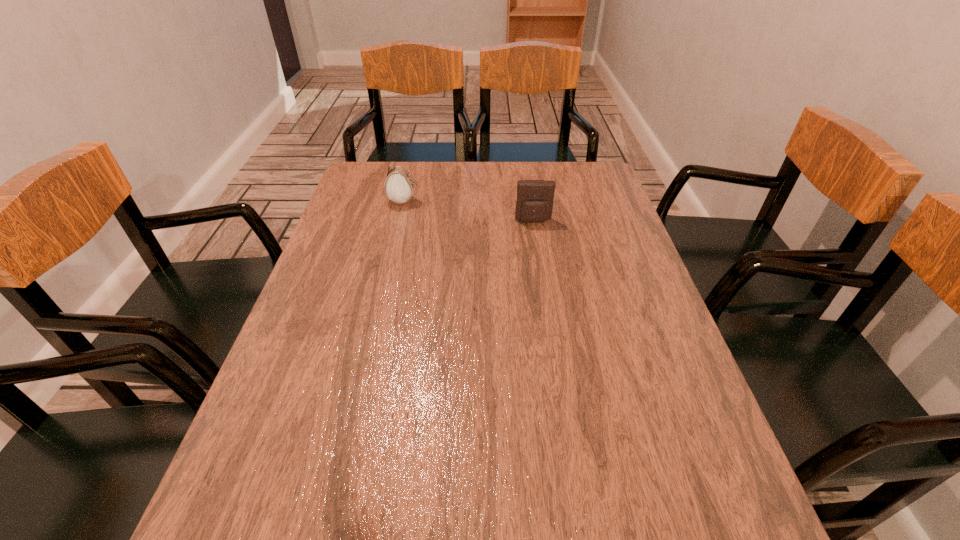
The height and width of the screenshot is (540, 960). Find the location of `the right pouch`. the right pouch is located at coordinates (534, 204).

Locate an element on the screen. The height and width of the screenshot is (540, 960). the second nearest object is located at coordinates (534, 204).

You are a GUI agent. You are given a task and a screenshot of the screen. Output one action in this format:
    pyautogui.click(x=<x>, y=<y>)
    Task: Click on the farther pouch
    
    Given the screenshot: What is the action you would take?
    pyautogui.click(x=399, y=185)

Find the location of `the farthest object`. the farthest object is located at coordinates (399, 185).

What are the coordinates of `blank area located 0.100m with an open flap on the nearer pouch` in the screenshot? It's located at (538, 247).

I want to click on free space located 0.220m on the front-facing side of the farthest object, so click(493, 201).

Identify the location of object that is at the far edge. Image resolution: width=960 pixels, height=540 pixels. point(399,185).

Identify the location of object that is at the left edge. Image resolution: width=960 pixels, height=540 pixels. (399, 185).

Locate an element on the screen. object that is at the far left corner is located at coordinates (399, 185).

The width and height of the screenshot is (960, 540). Find the location of `blank space at the far edge of the desktop`. blank space at the far edge of the desktop is located at coordinates (530, 178).